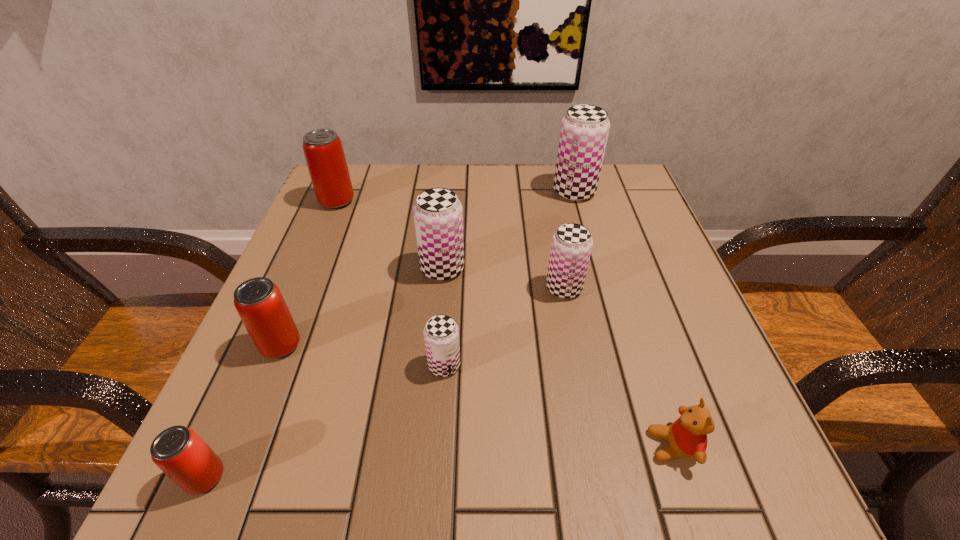
Where is `free region that satisfies the following two spatial constraints: 1. on the back side of the farthest purple beer can; 2. on the right side of the second biggest pink beer can`? The width and height of the screenshot is (960, 540). free region that satisfies the following two spatial constraints: 1. on the back side of the farthest purple beer can; 2. on the right side of the second biggest pink beer can is located at coordinates (343, 192).

The height and width of the screenshot is (540, 960). In order to click on free space that satisfies the following two spatial constraints: 1. on the back side of the nearest pink beer can; 2. on the right side of the smallest purple beer can in this screenshot , I will do `click(254, 365)`.

At what (x,y) coordinates should I click in order to perform the action: click on free space that satisfies the following two spatial constraints: 1. on the front side of the farthest pink beer can; 2. on the left side of the second smallest purple beer can. Please return your answer as a coordinate pair (x, y). The width and height of the screenshot is (960, 540). Looking at the image, I should click on (301, 288).

This screenshot has width=960, height=540. What are the coordinates of `vacant area that satisfies the following two spatial constraints: 1. on the back side of the biggest purple beer can; 2. on the right side of the nearest beer can` in the screenshot? It's located at (330, 192).